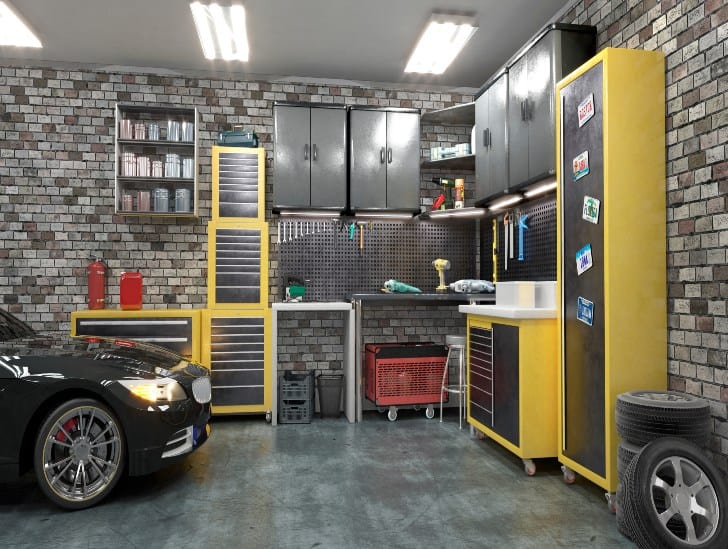
You are a GUI agent. You are given a task and a screenshot of the screen. Output one action in this format:
    pyautogui.click(x=<x>, y=<y>)
    Task: Click on the fire etinguiher
    
    Given the screenshot: What is the action you would take?
    pyautogui.click(x=98, y=290)